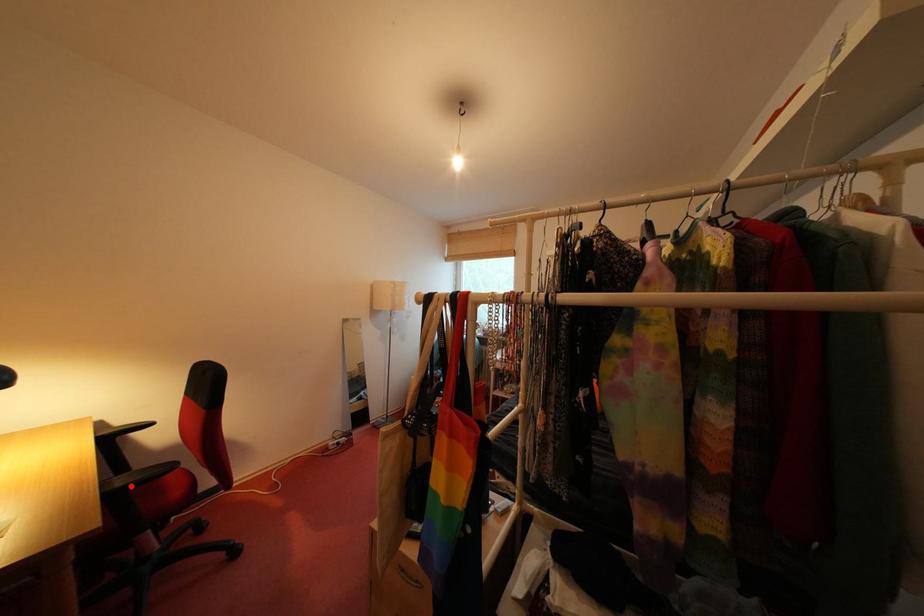
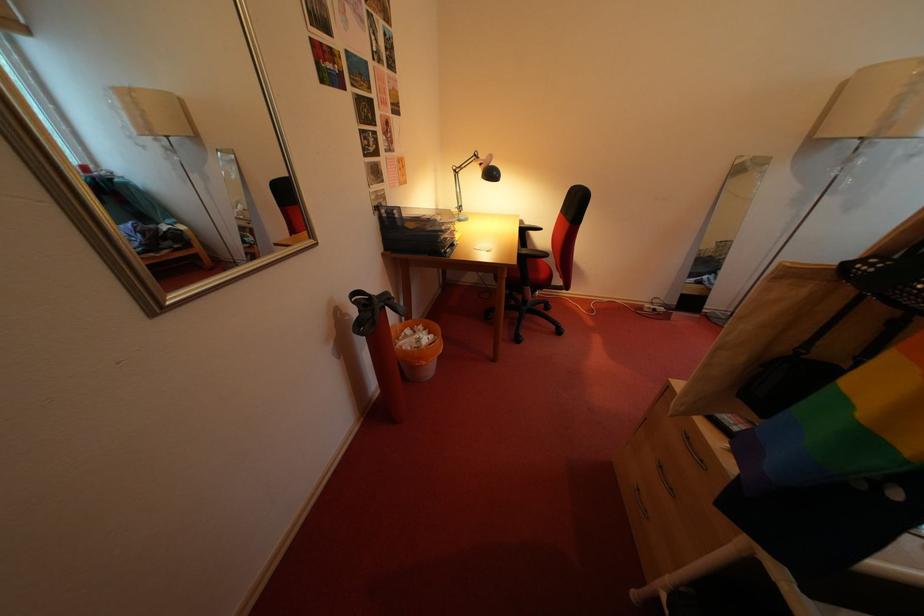
In the second image, find the point that corresponds to the highlighted location in the first image.

(535, 257)